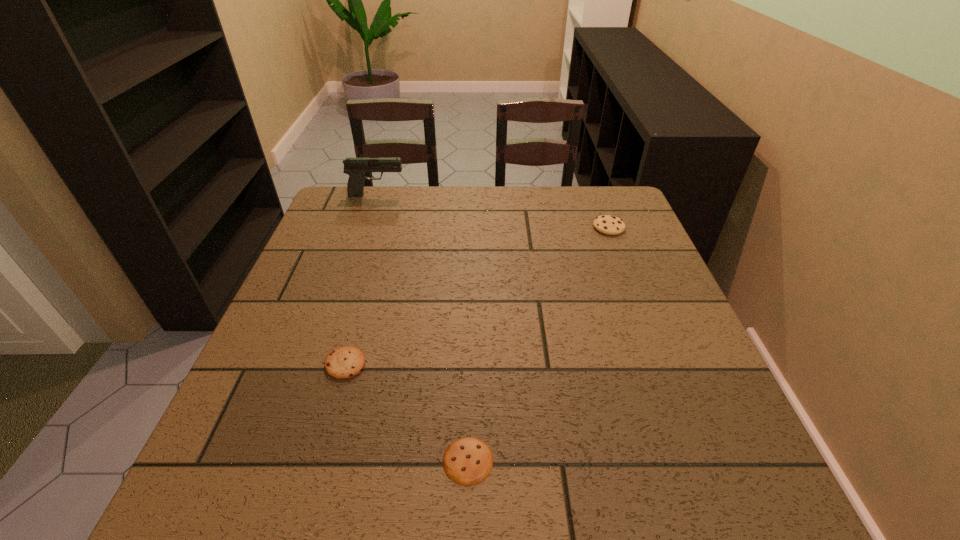
Where is `the farthest object`? The width and height of the screenshot is (960, 540). the farthest object is located at coordinates (355, 167).

Locate an element on the screen. the tallest object is located at coordinates (355, 167).

Identify the location of the third nearest object. This screenshot has height=540, width=960. (607, 224).

The width and height of the screenshot is (960, 540). I want to click on the rightmost cookie, so click(607, 224).

Identify the location of the second shortest object. (345, 362).

Locate an element on the screen. The width and height of the screenshot is (960, 540). the second nearest cookie is located at coordinates (345, 362).

Where is `the shortest object`? the shortest object is located at coordinates (467, 461).

At what (x,y) coordinates should I click in order to perform the action: click on the nearest cookie. Please return your answer as a coordinate pair (x, y). This screenshot has height=540, width=960. Looking at the image, I should click on (467, 461).

Find the location of a particular element. vacant space situated 0.110m aim along the barrel of the pistol is located at coordinates (441, 195).

Where is `vacant area located 0.360m on the left of the second farthest object`? This screenshot has width=960, height=540. vacant area located 0.360m on the left of the second farthest object is located at coordinates (466, 227).